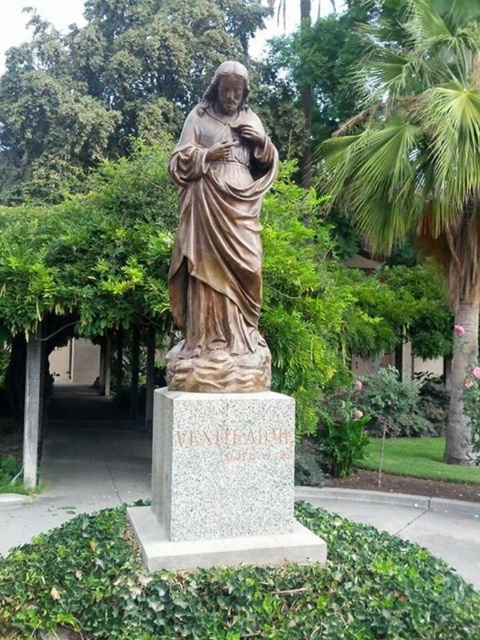
Question: Can you confirm if green leafy palm tree at center right is thinner than bronze statue at center?

Choices:
 (A) no
 (B) yes

Answer: (A)

Question: Considering the relative positions of green leafy palm tree at center right and bronze statue at center in the image provided, where is green leafy palm tree at center right located with respect to bronze statue at center?

Choices:
 (A) below
 (B) above

Answer: (B)

Question: Which of the following is the closest to the observer?

Choices:
 (A) bronze statue at center
 (B) green leafy palm tree at center right

Answer: (A)

Question: Which point is farther to the camera?

Choices:
 (A) green leafy palm tree at center right
 (B) bronze statue at center

Answer: (A)

Question: Is green leafy palm tree at center right to the left of bronze statue at center from the viewer's perspective?

Choices:
 (A) yes
 (B) no

Answer: (B)

Question: Which point is closer to the camera taking this photo?

Choices:
 (A) (469, 65)
 (B) (195, 266)

Answer: (B)